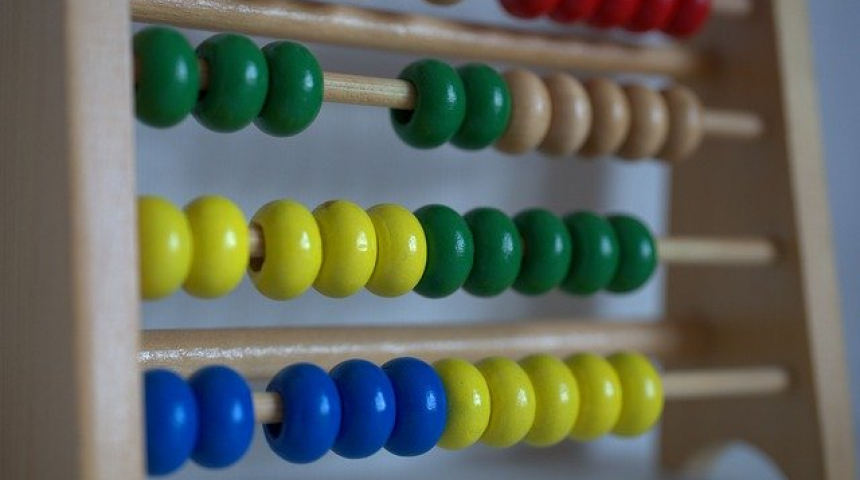
I want to click on green abacus beads, so click(169, 120), click(228, 119), click(308, 117), click(445, 115), click(471, 120), click(450, 240), click(499, 244), click(562, 249), click(588, 250), click(637, 252).